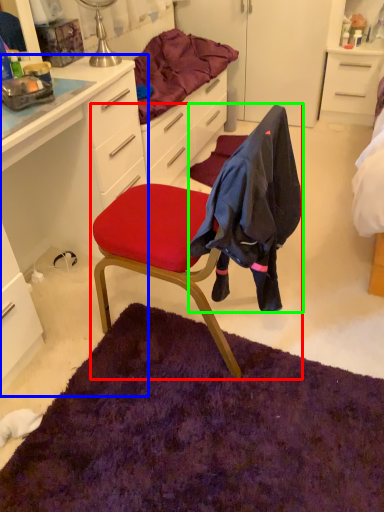
Question: Estimate the real-world distances between objects in this image. Which object is farther from chair (highlighted by a red box), cabinetry (highlighted by a blue box) or clothing (highlighted by a green box)?

Choices:
 (A) cabinetry
 (B) clothing

Answer: (A)